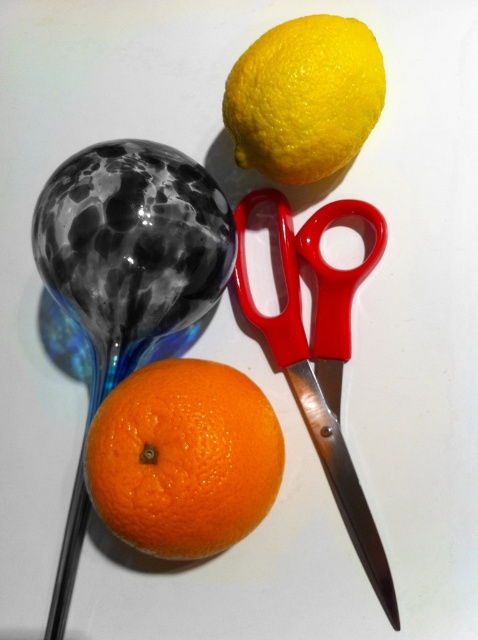
You are an artist setting up a still life. You have two points marked on your canvas at coordinates point (290, 172) and point (302, 385). Which point is closer to you as you face the canvas?

Point (290, 172) is closer to the camera than point (302, 385), so it is the closer point.

You are an artist setting up a still life. You have the orangesmoothorange at center and the yellow matte lemon at upper center. Which object is positioned closer to the front of the arrangement?

The orangesmoothorange at center is closer to the viewer than the yellow matte lemon at upper center, so it is positioned closer to the front of the arrangement.